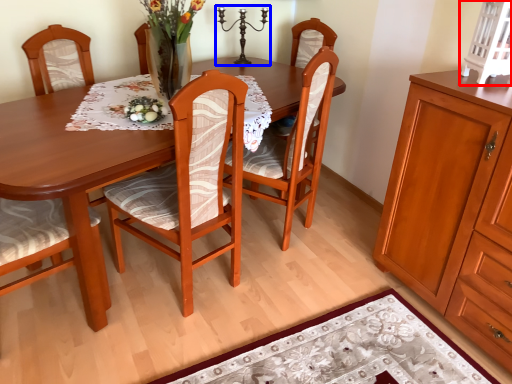
Question: Which object is further to the camera taking this photo, cabinetry (highlighted by a red box) or candle holder (highlighted by a blue box)?

Choices:
 (A) cabinetry
 (B) candle holder

Answer: (B)